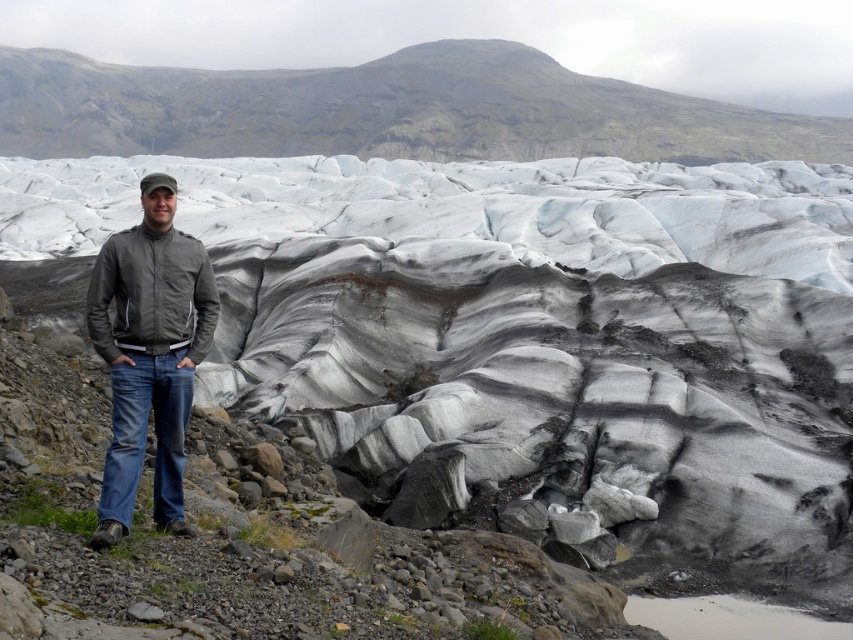
Is gray/white ice glacier at center below matte gray jacket at center?

Actually, gray/white ice glacier at center is above matte gray jacket at center.

Which of these two, gray/white ice glacier at center or matte gray jacket at center, stands shorter?

matte gray jacket at center

Is point (589, 433) positioned before point (91, 541)?

No.

The image size is (853, 640). Identify the location of gray/white ice glacier at center. (521, 339).